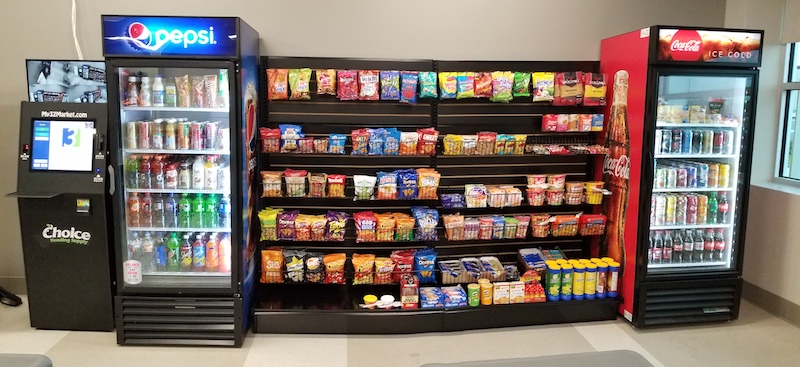
I want to click on drink cooler, so click(x=193, y=174), click(x=706, y=185).